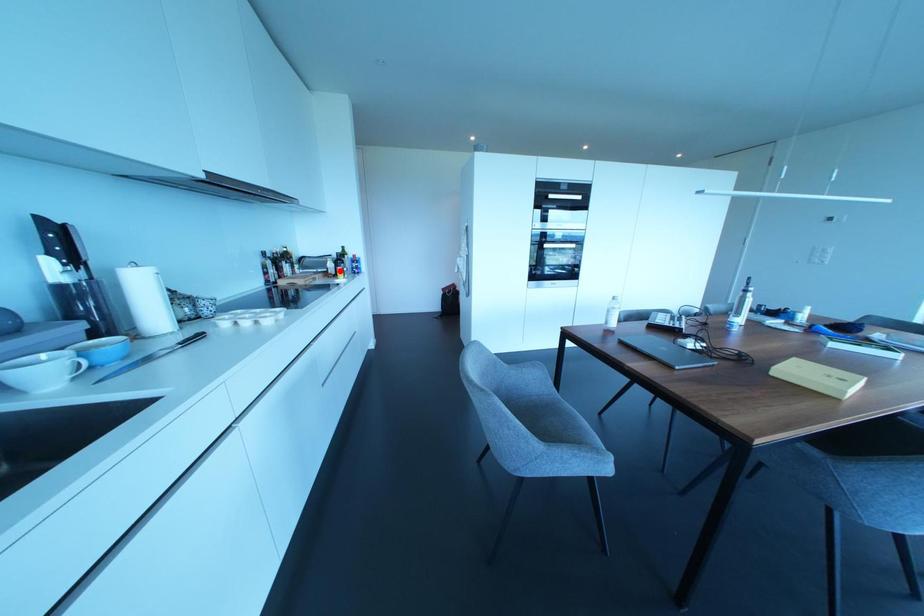
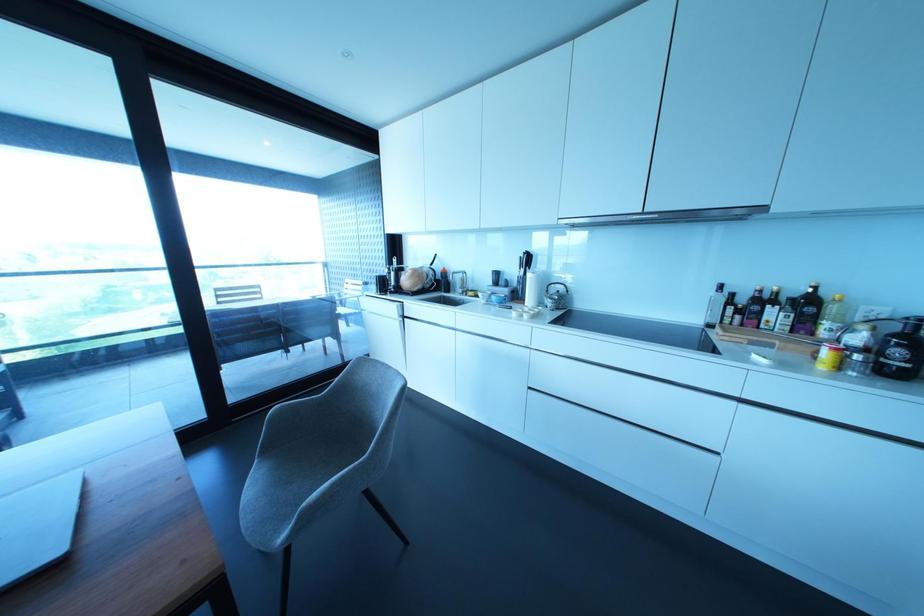
Locate, in the second image, the point that corresponds to the highlighted location in the first image.

(825, 353)